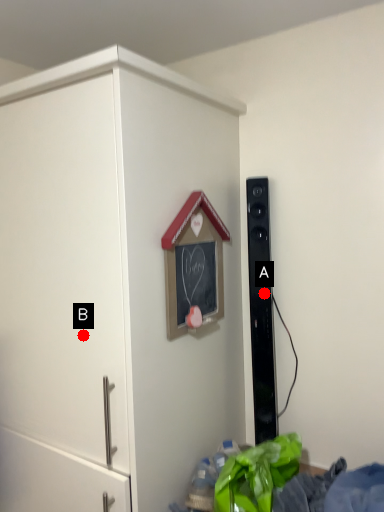
Question: Two points are circled on the image, labeled by A and B beside each circle. Which point appears farthest from the camera in this image?

Choices:
 (A) A is further
 (B) B is further

Answer: (A)